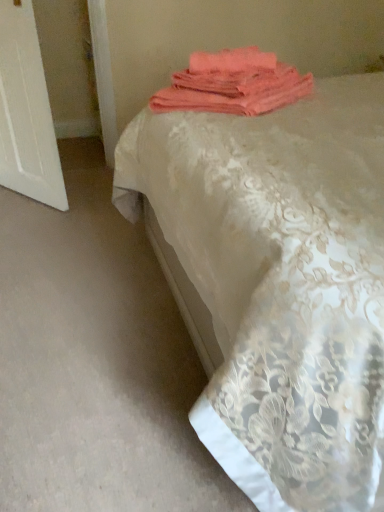
Find the location of a particular element. Image resolution: width=384 pixels, height=512 pixels. free space on the front side of white wood door at left is located at coordinates (38, 224).